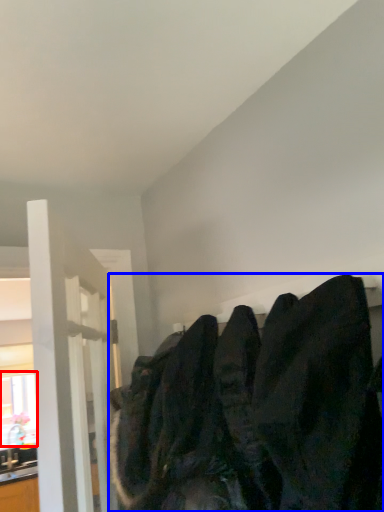
Question: Which object appears farthest to the camera in this image, window (highlighted by a red box) or sweatshirt (highlighted by a blue box)?

Choices:
 (A) window
 (B) sweatshirt

Answer: (A)